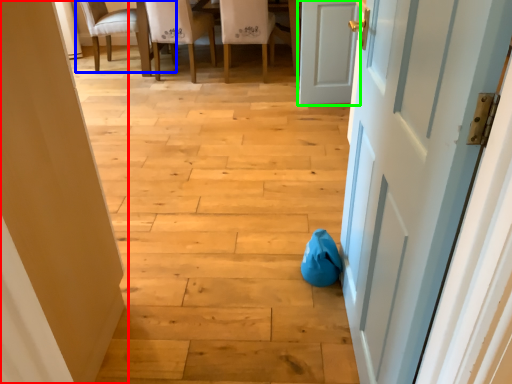
Question: Considering the real-world distances, which object is closest to door (highlighted by a red box)? chair (highlighted by a blue box) or door (highlighted by a green box).

Choices:
 (A) chair
 (B) door

Answer: (B)